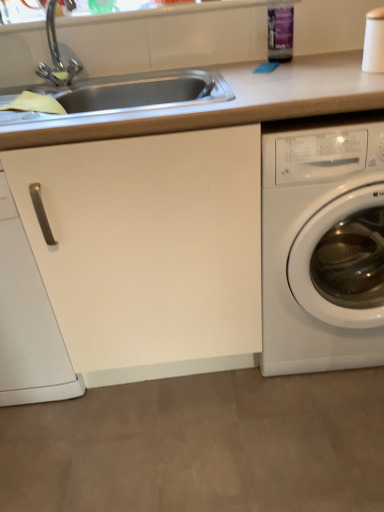
Question: Does smooth beige countertop at center have a lesser height compared to white glossy washing machine at right?

Choices:
 (A) no
 (B) yes

Answer: (A)

Question: Can you confirm if smooth beige countertop at center is positioned to the right of white glossy washing machine at right?

Choices:
 (A) no
 (B) yes

Answer: (A)

Question: From a real-world perspective, is smooth beige countertop at center positioned under white glossy washing machine at right based on gravity?

Choices:
 (A) no
 (B) yes

Answer: (A)

Question: Is smooth beige countertop at center wider than white glossy washing machine at right?

Choices:
 (A) yes
 (B) no

Answer: (B)

Question: From a real-world perspective, is smooth beige countertop at center positioned over white glossy washing machine at right based on gravity?

Choices:
 (A) no
 (B) yes

Answer: (B)

Question: Does smooth beige countertop at center touch white glossy washing machine at right?

Choices:
 (A) yes
 (B) no

Answer: (B)

Question: Can you confirm if white glossy washing machine at right is bigger than smooth beige countertop at center?

Choices:
 (A) yes
 (B) no

Answer: (B)

Question: Is white glossy washing machine at right facing towards smooth beige countertop at center?

Choices:
 (A) no
 (B) yes

Answer: (B)

Question: Is white glossy washing machine at right completely or partially outside of smooth beige countertop at center?

Choices:
 (A) yes
 (B) no

Answer: (B)

Question: Are white glossy washing machine at right and smooth beige countertop at center far apart?

Choices:
 (A) no
 (B) yes

Answer: (A)

Question: From a real-world perspective, is white glossy washing machine at right located higher than smooth beige countertop at center?

Choices:
 (A) yes
 (B) no

Answer: (B)

Question: Is white glossy washing machine at right smaller than smooth beige countertop at center?

Choices:
 (A) no
 (B) yes

Answer: (B)

Question: From a real-world perspective, is white glossy washing machine at right physically below white matte cabinet handle at left?

Choices:
 (A) no
 (B) yes

Answer: (B)